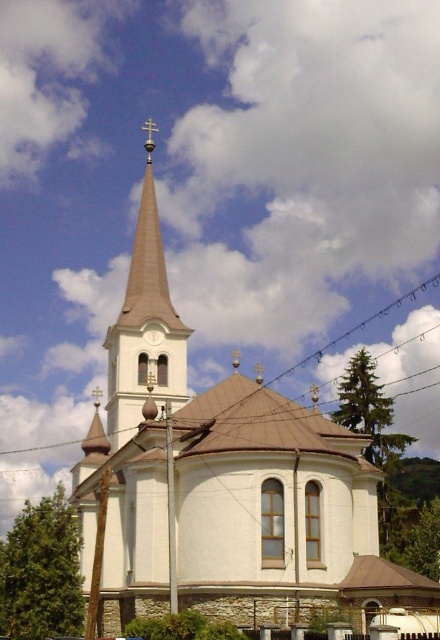
Question: Among these points, which one is farthest from the camera?

Choices:
 (A) (429, 604)
 (B) (154, 337)
 (C) (113, 410)

Answer: (B)

Question: Is white stone church at center further to the viewer compared to white metallic clock at upper center?

Choices:
 (A) yes
 (B) no

Answer: (B)

Question: Is white stucco tower at upper center smaller than white metallic clock at upper center?

Choices:
 (A) no
 (B) yes

Answer: (A)

Question: Which point is closer to the camera?

Choices:
 (A) white stone church at center
 (B) white metallic clock at upper center
 (C) white stucco tower at upper center

Answer: (A)

Question: Is white stucco tower at upper center behind white metallic clock at upper center?

Choices:
 (A) no
 (B) yes

Answer: (A)

Question: Estimate the real-world distances between objects in this image. Which object is farther from the white metallic clock at upper center?

Choices:
 (A) white stucco tower at upper center
 (B) white stone church at center

Answer: (B)